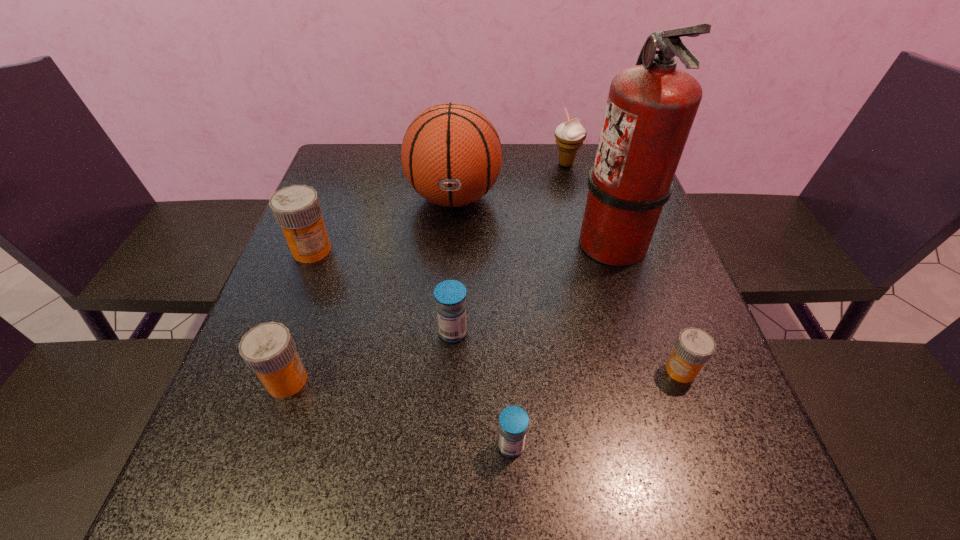
The image size is (960, 540). I want to click on medicine present at the right edge, so click(x=694, y=347).

I want to click on object positioned at the far right corner, so click(569, 135).

Find the location of a particular element. free space at the far edge of the desktop is located at coordinates (558, 161).

The height and width of the screenshot is (540, 960). What are the coordinates of `blank space at the left edge of the desktop` in the screenshot? It's located at (331, 213).

Where is `free space at the right edge`? Image resolution: width=960 pixels, height=540 pixels. free space at the right edge is located at coordinates (648, 367).

This screenshot has width=960, height=540. In order to click on vacant area at the far left corner of the desktop in this screenshot , I will do `click(345, 161)`.

Identify the location of vacant space at the near left corner of the desktop. (220, 478).

Where is `blank region between the white icecream and the seventh shortest object`? The height and width of the screenshot is (540, 960). blank region between the white icecream and the seventh shortest object is located at coordinates (510, 181).

This screenshot has width=960, height=540. Find the location of `vacant space that is in between the third medicine from left to right and the rightmost medicine`. vacant space that is in between the third medicine from left to right and the rightmost medicine is located at coordinates pyautogui.click(x=566, y=352).

What are the coordinates of `free area in between the tallest object and the basketball` in the screenshot? It's located at (533, 220).